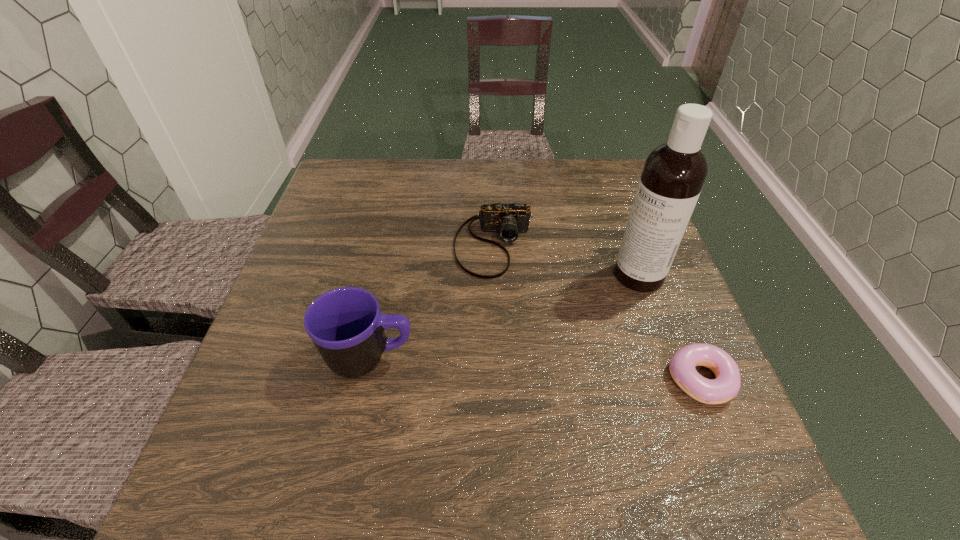
Where is `blank region between the dishwasher detergent and the camera`? This screenshot has height=540, width=960. blank region between the dishwasher detergent and the camera is located at coordinates (566, 260).

The image size is (960, 540). In order to click on vacant point located between the second object from left to right and the leftmost object in this screenshot , I will do `click(432, 301)`.

Find the location of a particular element. This screenshot has width=960, height=540. empty space between the third tallest object and the shortest object is located at coordinates (597, 312).

Where is `vacant area that lies between the tallest object and the mug`? vacant area that lies between the tallest object and the mug is located at coordinates (504, 317).

In order to click on empty space that is in between the doughnut and the second shortest object in this screenshot , I will do `click(597, 312)`.

The height and width of the screenshot is (540, 960). Find the location of `vacant area that lies between the dishwasher detergent and the leftmost object`. vacant area that lies between the dishwasher detergent and the leftmost object is located at coordinates (504, 317).

Locate an element on the screen. The image size is (960, 540). object that is the third nearest to the shortest object is located at coordinates (345, 324).

Identify which object is located as the second nearest to the mug. Please provide its 2D coordinates. Your answer should be formatted as a tuple, i.e. [(x, y)], where the tuple contains the x and y coordinates of a point satisfying the conditions above.

[(674, 173)]

You are a GUI agent. You are given a task and a screenshot of the screen. Output one action in this format:
    pyautogui.click(x=<x>, y=<y>)
    Task: Click on the vacant area that satisfies the following two spatial constraints: 1. on the front side of the shortest object; 2. on the right side of the second shortest object
    The image size is (960, 540).
    Given the screenshot: What is the action you would take?
    pyautogui.click(x=499, y=380)